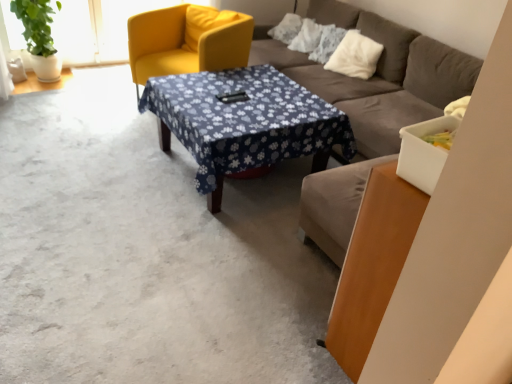
At what (x,y) coordinates should I click in order to perform the action: click on blue floral fabric at center. Please return your answer as a coordinate pair (x, y). The height and width of the screenshot is (384, 512). Looking at the image, I should click on (244, 121).

The image size is (512, 384). I want to click on white fluffy pillow at upper right, so click(x=355, y=56).

Where is `matte yellow armchair at upper left`? matte yellow armchair at upper left is located at coordinates (183, 44).

Is point (455, 77) closer or farther from the camera than point (231, 30)?

Point (455, 77) is positioned closer to the camera compared to point (231, 30).

From the image's perspective, which one is positioned lower, brown fabric couch at center or matte yellow armchair at upper left?

brown fabric couch at center, from the image's perspective.

Which object is closer to the camera taking this photo, brown fabric couch at center or matte yellow armchair at upper left?

brown fabric couch at center is more forward.

Based on the photo, would you say brown fabric couch at center is inside or outside matte yellow armchair at upper left?

brown fabric couch at center is not enclosed by matte yellow armchair at upper left.

Is blue floral fabric at center looking in the opposite direction of white fluffy pillow at upper right?

That's right, blue floral fabric at center is facing away from white fluffy pillow at upper right.

Considering the sizes of blue floral fabric at center and white fluffy pillow at upper right in the image, is blue floral fabric at center bigger or smaller than white fluffy pillow at upper right?

blue floral fabric at center is bigger than white fluffy pillow at upper right.

Does blue floral fabric at center come behind white fluffy pillow at upper right?

No, blue floral fabric at center is closer to the viewer.

How different are the orientations of blue floral fabric at center and white fluffy pillow at upper right in degrees?

They differ by 18.5 degrees in their facing directions.

From a real-world perspective, is brown fabric couch at center above or below white fluffy pillow at upper right?

brown fabric couch at center is situated lower than white fluffy pillow at upper right in the real world.

Is brown fabric couch at center far from white fluffy pillow at upper right?

brown fabric couch at center is actually quite close to white fluffy pillow at upper right.

Who is bigger, brown fabric couch at center or white fluffy pillow at upper right?

brown fabric couch at center.

Is blue floral fabric at center positioned beyond the bounds of brown fabric couch at center?

Yes.

Is blue floral fabric at center in front of brown fabric couch at center?

Yes, blue floral fabric at center is closer to the viewer.

Locate an element on the screen. The image size is (512, 384). coffee table on the left of the brown fabric couch at center is located at coordinates (244, 121).

Is blue floral fabric at center to the left of brown fabric couch at center from the viewer's perspective?

Yes.

From the image's perspective, between brown fabric couch at center and blue floral fabric at center, which one is located above?

From the image's view, brown fabric couch at center is above.

Is brown fabric couch at center completely or partially outside of blue floral fabric at center?

Absolutely, brown fabric couch at center is external to blue floral fabric at center.

Can you tell me how much brown fabric couch at center and blue floral fabric at center differ in facing direction?

brown fabric couch at center and blue floral fabric at center are facing 0.000202 degrees away from each other.

Looking at this image, based on their positions, is matte yellow armchair at upper left located to the left or right of white fluffy pillow at upper right?

Clearly, matte yellow armchair at upper left is on the left of white fluffy pillow at upper right in the image.

Is matte yellow armchair at upper left next to white fluffy pillow at upper right and touching it?

There is a gap between matte yellow armchair at upper left and white fluffy pillow at upper right.

Is matte yellow armchair at upper left smaller than white fluffy pillow at upper right?

Incorrect, matte yellow armchair at upper left is not smaller in size than white fluffy pillow at upper right.

Can you confirm if white fluffy pillow at upper right is thinner than matte yellow armchair at upper left?

Indeed, white fluffy pillow at upper right has a lesser width compared to matte yellow armchair at upper left.

Between white fluffy pillow at upper right and matte yellow armchair at upper left, which one has larger size?

matte yellow armchair at upper left.

Which is correct: white fluffy pillow at upper right is inside matte yellow armchair at upper left, or outside of it?

white fluffy pillow at upper right is spatially situated outside matte yellow armchair at upper left.

I want to click on studio couch in front of the matte yellow armchair at upper left, so click(377, 75).

The image size is (512, 384). What are the coordinates of `coffee table below the white fluffy pillow at upper right (from the image's perspective)` in the screenshot? It's located at pos(244,121).

Which object lies nearer to the anchor point blue floral fabric at center, white fluffy pillow at upper right or matte yellow armchair at upper left?

Among the two, matte yellow armchair at upper left is located nearer to blue floral fabric at center.

Considering their positions, is blue floral fabric at center positioned further to matte yellow armchair at upper left than white fluffy pillow at upper right?

white fluffy pillow at upper right lies further to matte yellow armchair at upper left than the other object.

Based on their spatial positions, is brown fabric couch at center or blue floral fabric at center closer to matte yellow armchair at upper left?

blue floral fabric at center is closer to matte yellow armchair at upper left.

Looking at the image, which one is located further to brown fabric couch at center, white fluffy pillow at upper right or blue floral fabric at center?

The object further to brown fabric couch at center is blue floral fabric at center.

From the image, which object appears to be nearer to matte yellow armchair at upper left, brown fabric couch at center or white fluffy pillow at upper right?

Based on the image, brown fabric couch at center appears to be nearer to matte yellow armchair at upper left.

From the image, which object appears to be farther from white fluffy pillow at upper right, brown fabric couch at center or blue floral fabric at center?

blue floral fabric at center.

Estimate the real-world distances between objects in this image. Which object is further from matte yellow armchair at upper left, white fluffy pillow at upper right or brown fabric couch at center?

white fluffy pillow at upper right lies further to matte yellow armchair at upper left than the other object.

Considering their positions, is matte yellow armchair at upper left positioned closer to blue floral fabric at center than brown fabric couch at center?

Among the two, matte yellow armchair at upper left is located nearer to blue floral fabric at center.

Where is `coffee table located between matte yellow armchair at upper left and white fluffy pillow at upper right in the left-right direction`? The height and width of the screenshot is (384, 512). coffee table located between matte yellow armchair at upper left and white fluffy pillow at upper right in the left-right direction is located at coordinates (244, 121).

The height and width of the screenshot is (384, 512). I want to click on coffee table between matte yellow armchair at upper left and brown fabric couch at center in the horizontal direction, so click(244, 121).

This screenshot has width=512, height=384. I want to click on studio couch positioned between blue floral fabric at center and white fluffy pillow at upper right from near to far, so click(x=377, y=75).

Identify the location of studio couch between matte yellow armchair at upper left and white fluffy pillow at upper right. (377, 75).